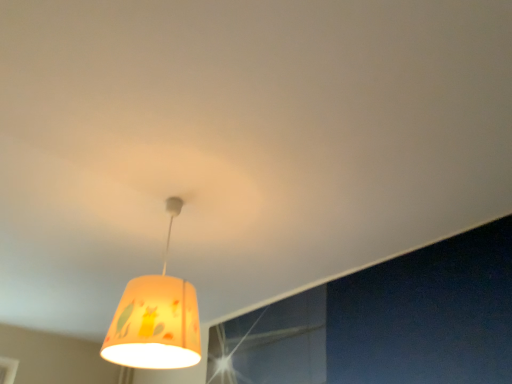
What are the coordinates of `matte yellow lampshade at center` in the screenshot? It's located at (156, 319).

What do you see at coordinates (156, 319) in the screenshot? The width and height of the screenshot is (512, 384). I see `matte yellow lampshade at center` at bounding box center [156, 319].

Find the location of a particular element. The height and width of the screenshot is (384, 512). matte yellow lampshade at center is located at coordinates (156, 319).